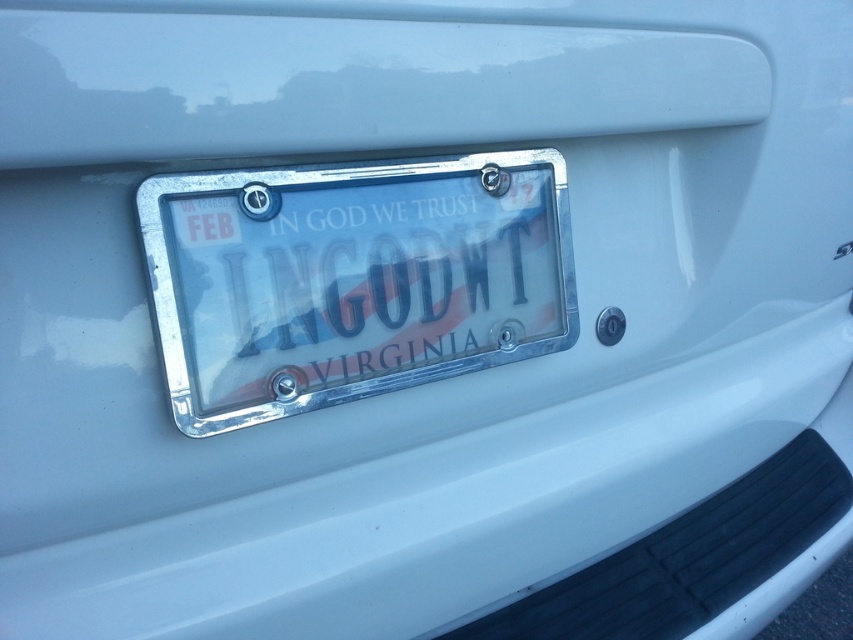
Who is more distant from viewer, [265,257] or [515,209]?

The point [515,209] is behind.

In order to click on chrome metallic license plate at center in this screenshot , I will do `click(352, 280)`.

Locate an element on the screen. This screenshot has width=853, height=640. chrome metallic license plate at center is located at coordinates (352, 280).